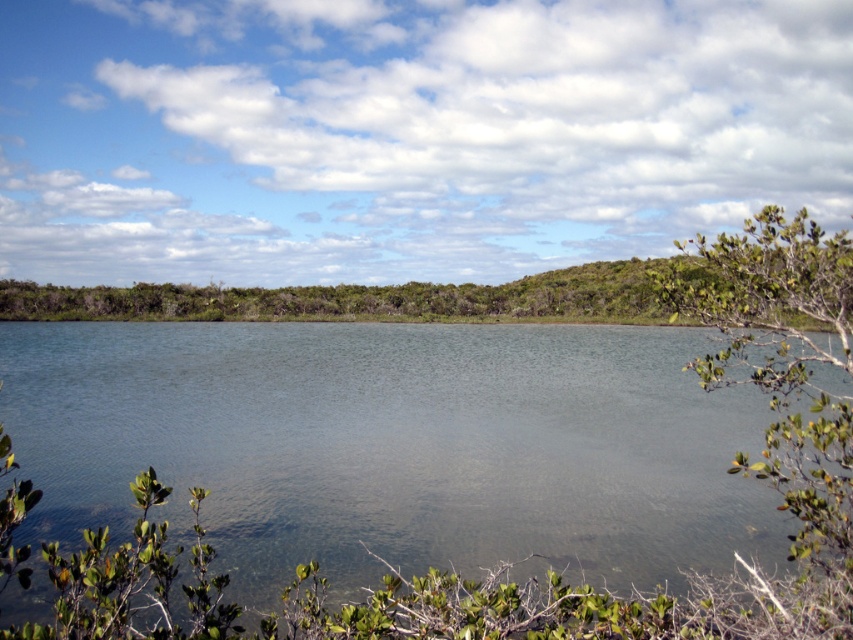
Is clear water at center to the right of green leafy shrub at right from the viewer's perspective?

Incorrect, clear water at center is not on the right side of green leafy shrub at right.

Who is more forward, [599,387] or [718,272]?

Point [718,272]

What do you see at coordinates (393, 442) in the screenshot? This screenshot has height=640, width=853. I see `clear water at center` at bounding box center [393, 442].

At what (x,y) coordinates should I click in order to perform the action: click on clear water at center. Please return your answer as a coordinate pair (x, y). The width and height of the screenshot is (853, 640). Looking at the image, I should click on (393, 442).